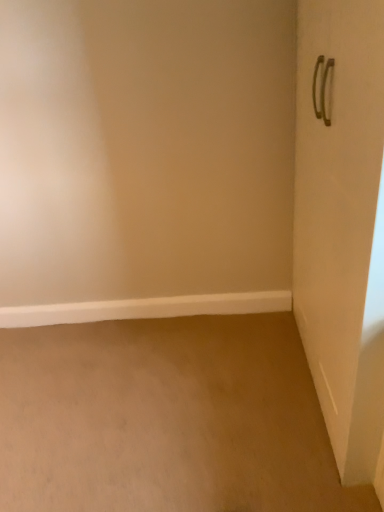
Locate an element on the screen. free point above white smooth baseboard at lower left (from a real-world perspective) is located at coordinates (147, 297).